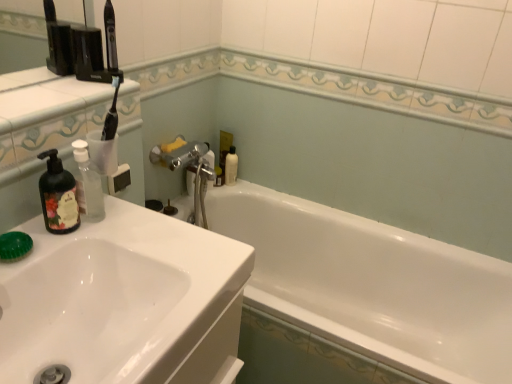
Identify the location of free location in front of matte black soap dispenser at left. The height and width of the screenshot is (384, 512). (40, 249).